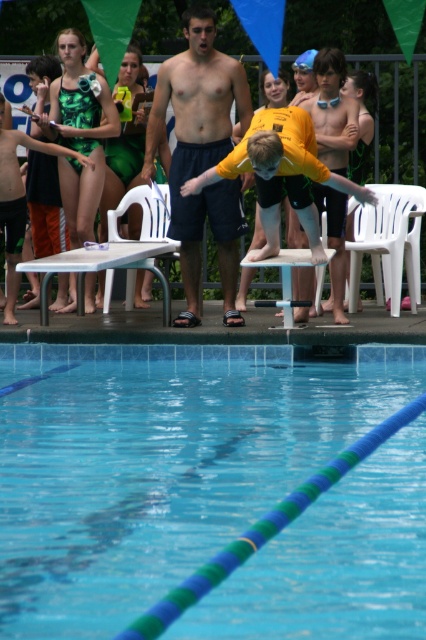
You are standing at the point marked as point (x=31, y=420) and want to jump into the pool. The diving board is 9.68 meters away from you. Can you safely reach the diving board from your current position without entering the water?

The diving board is 9.68 meters away from point (x=31, y=420). Since the distance is significant, you would need to walk along the pool deck to reach it safely without entering the water.

You are a photographer at the poolside. You have a camera with a 12x18 inch frame. The yellow matte shirt at center and the green textured swimsuit at left are both in your view. Can both objects fit within the frame if you adjust the camera angle to include both?

The yellow matte shirt at center is bigger than the green textured swimsuit at left. Since the camera frame is 12x18 inches, both objects can fit within the frame as long as their combined size does not exceed the frame dimensions. Adjust the angle to ensure both are within the 12x18 inch area.

You are standing at the edge of the pool and want to reach both the point at coordinates point (319, 230) and point (13, 321). Which point should you go to first to minimize the distance you walk?

You should go to point (319, 230) first because it is closer to you than point (13, 321).